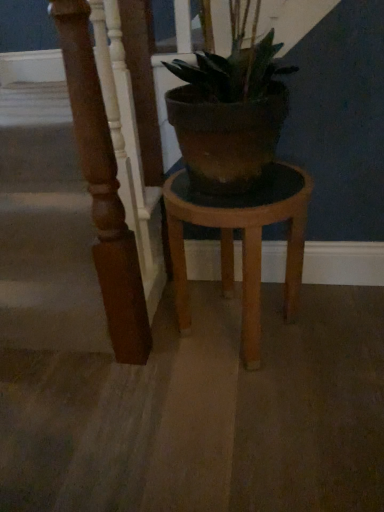
You are a GUI agent. You are given a task and a screenshot of the screen. Output one action in this format:
    pyautogui.click(x=<x>, y=<y>)
    Task: Click on the vacant space to the right of wooden stool at center
    The height and width of the screenshot is (512, 384).
    Given the screenshot: What is the action you would take?
    pyautogui.click(x=339, y=328)